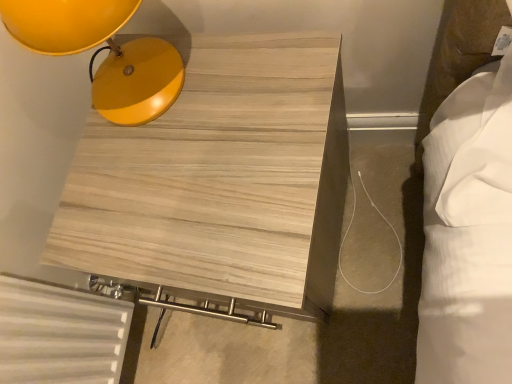
You are a GUI agent. You are given a task and a screenshot of the screen. Output one action in this format:
    pyautogui.click(x=<x>, y=<y>)
    Task: Click on the free space above light wood/texture side table at upper left (from a real-world perspective)
    The height and width of the screenshot is (384, 512).
    Given the screenshot: What is the action you would take?
    pyautogui.click(x=193, y=152)